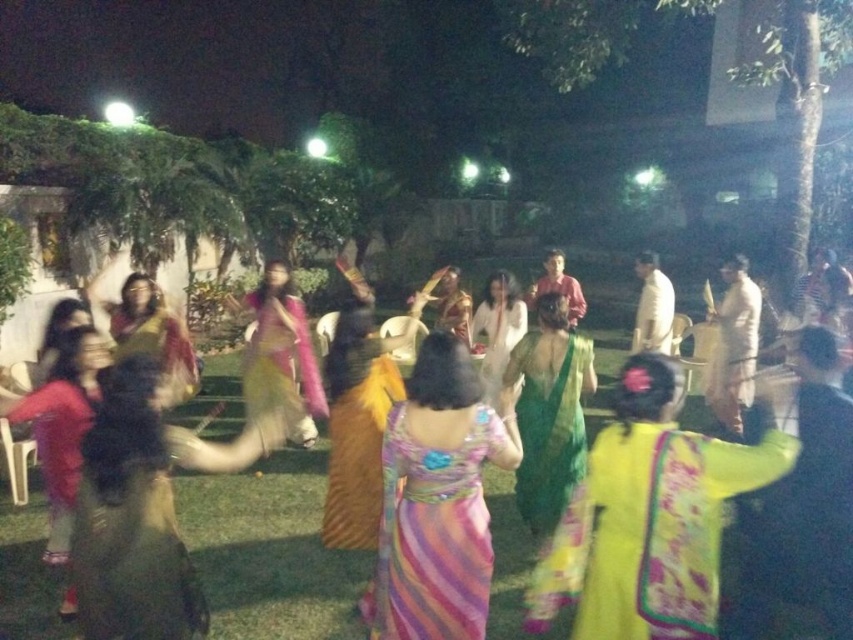
Does point (398, 422) come closer to viewer compared to point (733, 284)?

Yes.

Is multicolored satin dress at center closer to camera compared to white silk saree at center?

Yes, multicolored satin dress at center is in front of white silk saree at center.

Which is behind, point (459, 621) or point (744, 392)?

Point (744, 392)

The image size is (853, 640). I want to click on multicolored satin dress at center, so click(x=433, y=532).

Between point (509, 460) and point (310, 368), which one is positioned in front?

Point (509, 460) is in front.

Is point (442, 536) positioned behind point (282, 333)?

No.

Where is `multicolored satin dress at center`? The height and width of the screenshot is (640, 853). multicolored satin dress at center is located at coordinates (433, 532).

Is multicolored silk saree at center smaller than green silk saree at center?

→ Yes, multicolored silk saree at center is smaller than green silk saree at center.

Does point (308, 452) come behind point (548, 483)?

Yes, point (308, 452) is behind point (548, 483).

Identify the location of multicolored silk saree at center. (271, 550).